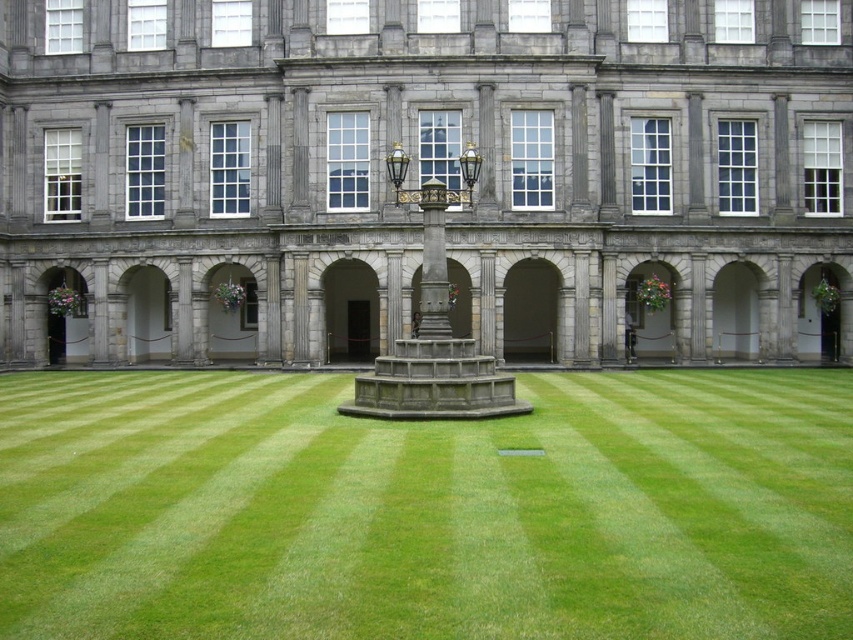
You are standing in the courtyard and want to walk from the gray stone building at center to the green grass at center. Which direction should you move in?

You should move away from the gray stone building at center towards the green grass at center because the gray stone building at center is closer to you than the green grass at center.

You are a landscape architect designing a new garden for the courtyard. The gray stone building at center and the green grass at center are both important elements. Which of these two elements takes up more space in the courtyard?

The gray stone building at center is bigger than green grass at center, so it takes up more space in the courtyard.

You are standing in the courtyard of a historic building. You notice the gray stone building at center and the green grass at center. Which object is taller?

The gray stone building at center has a greater height compared to the green grass at center, so the gray stone building at center is taller.